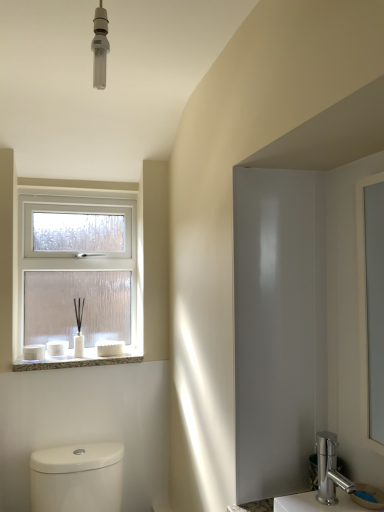
Question: Should I look upward or downward to see white textured stone at lower left?

Choices:
 (A) up
 (B) down

Answer: (B)

Question: Does white glossy toilet at lower left appear on the right side of polished silver faucet at lower right?

Choices:
 (A) no
 (B) yes

Answer: (A)

Question: Does white glossy toilet at lower left have a lesser height compared to polished silver faucet at lower right?

Choices:
 (A) yes
 (B) no

Answer: (B)

Question: Can you confirm if white glossy toilet at lower left is taller than polished silver faucet at lower right?

Choices:
 (A) no
 (B) yes

Answer: (B)

Question: Does white glossy toilet at lower left have a greater width compared to polished silver faucet at lower right?

Choices:
 (A) yes
 (B) no

Answer: (A)

Question: Is white glossy toilet at lower left looking in the opposite direction of polished silver faucet at lower right?

Choices:
 (A) no
 (B) yes

Answer: (A)

Question: Does white glossy toilet at lower left have a smaller size compared to polished silver faucet at lower right?

Choices:
 (A) no
 (B) yes

Answer: (A)

Question: From the image's perspective, is white glossy toilet at lower left below white textured stone at lower left?

Choices:
 (A) yes
 (B) no

Answer: (A)

Question: Is white glossy toilet at lower left positioned with its back to white textured stone at lower left?

Choices:
 (A) yes
 (B) no

Answer: (B)

Question: Is white glossy toilet at lower left thinner than white textured stone at lower left?

Choices:
 (A) yes
 (B) no

Answer: (B)

Question: Considering the relative sizes of white glossy toilet at lower left and white textured stone at lower left in the image provided, is white glossy toilet at lower left shorter than white textured stone at lower left?

Choices:
 (A) yes
 (B) no

Answer: (B)

Question: Considering the relative positions of white glossy toilet at lower left and white textured stone at lower left in the image provided, is white glossy toilet at lower left to the left of white textured stone at lower left from the viewer's perspective?

Choices:
 (A) yes
 (B) no

Answer: (B)

Question: Considering the relative positions of white glossy toilet at lower left and white textured stone at lower left in the image provided, is white glossy toilet at lower left in front of white textured stone at lower left?

Choices:
 (A) yes
 (B) no

Answer: (A)

Question: Is clear glass window at upper left at the left side of white glossy toilet at lower left?

Choices:
 (A) yes
 (B) no

Answer: (A)